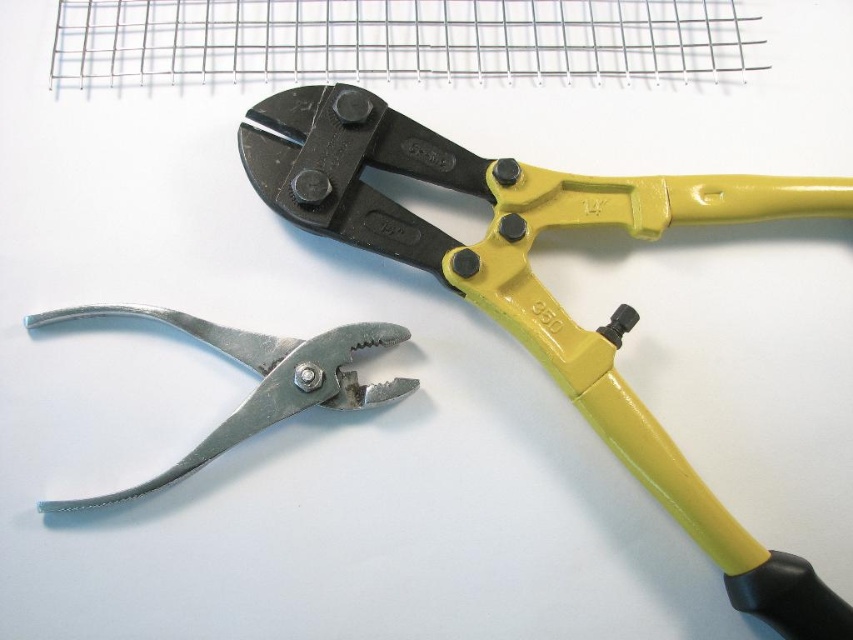
Does point (399, 122) come behind point (264, 353)?

That is True.

Does yellow matte/black textured bolt cutter at upper right have a greater width compared to metallic silver pliers at lower left?

Indeed, yellow matte/black textured bolt cutter at upper right has a greater width compared to metallic silver pliers at lower left.

Who is more distant from viewer, (805, 620) or (245, 417)?

The point (245, 417) is more distant.

Locate an element on the screen. yellow matte/black textured bolt cutter at upper right is located at coordinates (543, 285).